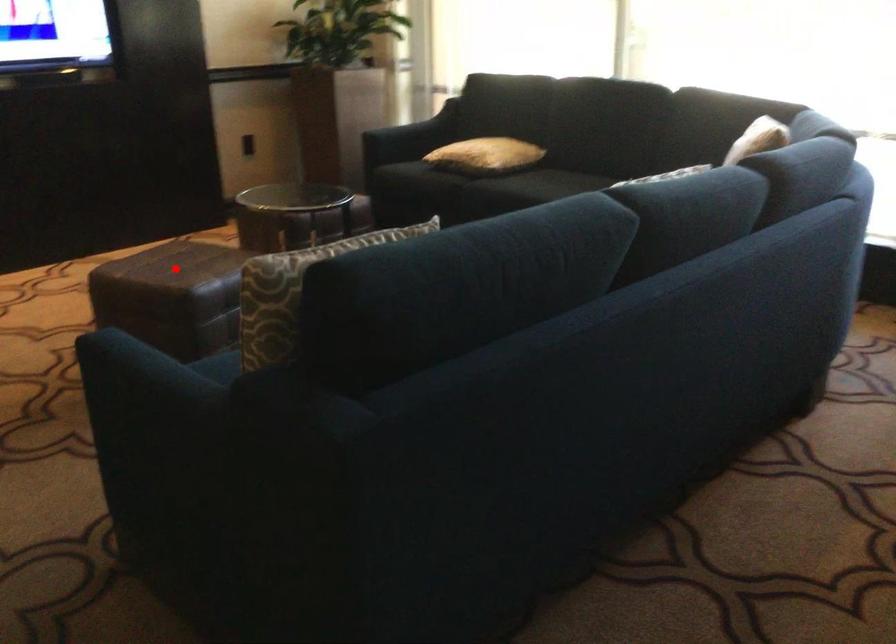
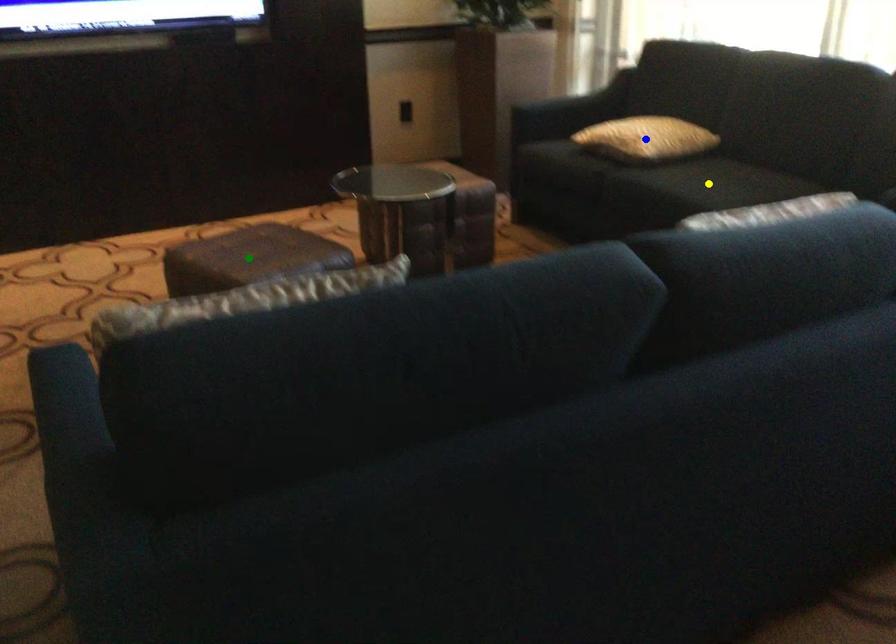
Question: I am providing you with two images of the same scene from different viewpoints. A red point is marked on the first image. You are given multiple points on the second image. Which point in image 2 represents the same 3d spot as the red point in image 1?

Choices:
 (A) yellow point
 (B) green point
 (C) blue point

Answer: (B)